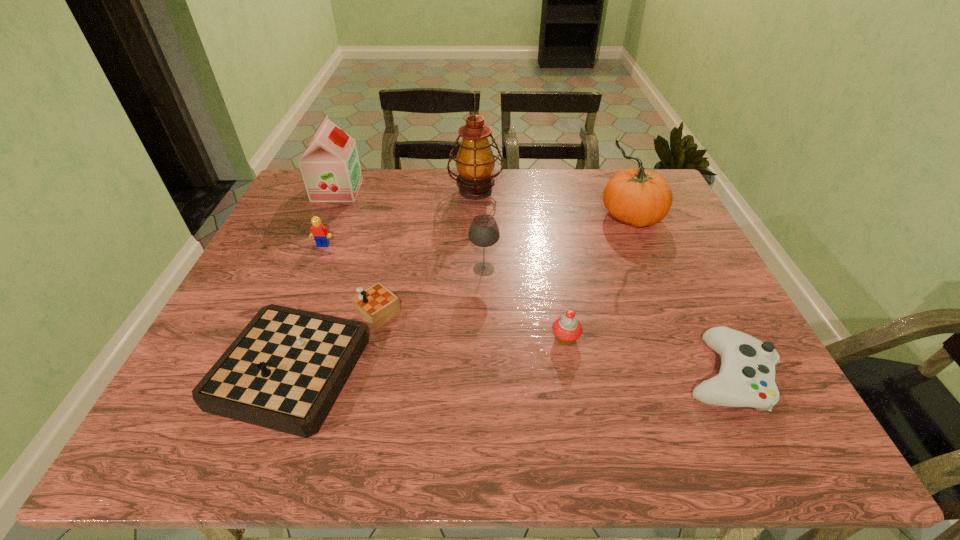
You are a GUI agent. You are given a task and a screenshot of the screen. Output one action in this format:
    pyautogui.click(x=<x>, y=<y>)
    Task: Click on the object that is at the near right corner
    
    Given the screenshot: What is the action you would take?
    pyautogui.click(x=746, y=378)

I want to click on free space at the far edge of the desktop, so click(485, 204).

The image size is (960, 540). In the image, there is a desktop. In order to click on free space at the near edge in this screenshot , I will do `click(581, 424)`.

Locate an element on the screen. vacant space at the right edge of the desktop is located at coordinates (701, 330).

In the image, there is a desktop. Identify the location of vacant space at the near left corner. (204, 415).

In the image, there is a desktop. Identify the location of vacant area at the near right corner. This screenshot has height=540, width=960. (784, 415).

The height and width of the screenshot is (540, 960). I want to click on vacant area that lies between the shortest object and the oil lamp, so click(601, 283).

Image resolution: width=960 pixels, height=540 pixels. What are the coordinates of `free space between the fourth farthest object and the cupcake` in the screenshot? It's located at (444, 292).

This screenshot has height=540, width=960. In order to click on free spot between the chessboard and the soya milk in this screenshot , I will do tap(324, 274).

Find the location of a particular element. free space between the oil lamp and the pumpkin is located at coordinates (553, 204).